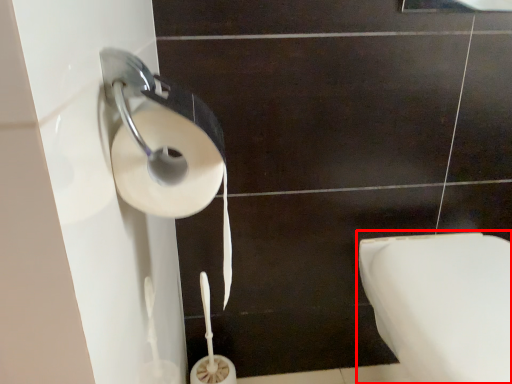
Question: From the image's perspective, what is the correct spatial relationship of toilet (annotated by the red box) in relation to toilet paper?

Choices:
 (A) below
 (B) above

Answer: (A)